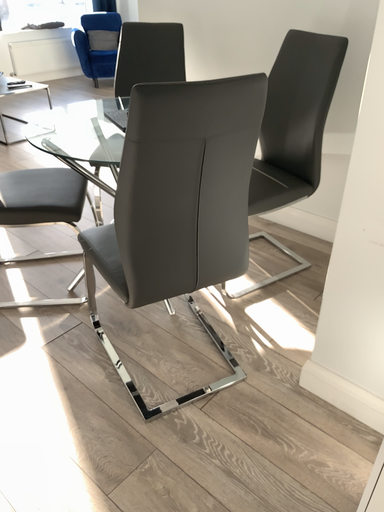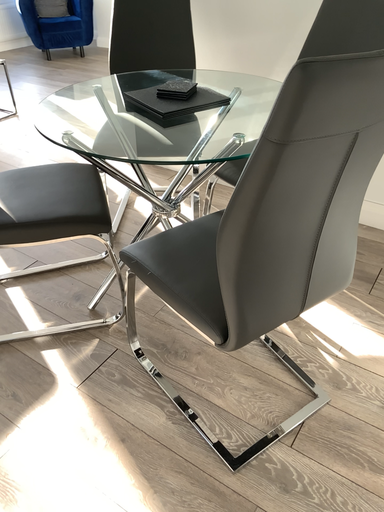
Question: Which way did the camera rotate in the video?

Choices:
 (A) rotated left
 (B) rotated right

Answer: (B)